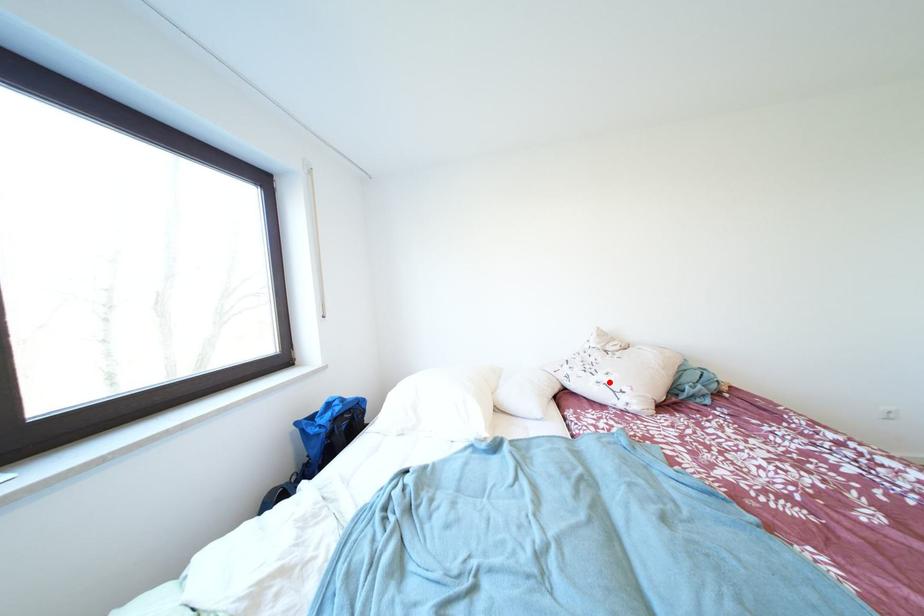
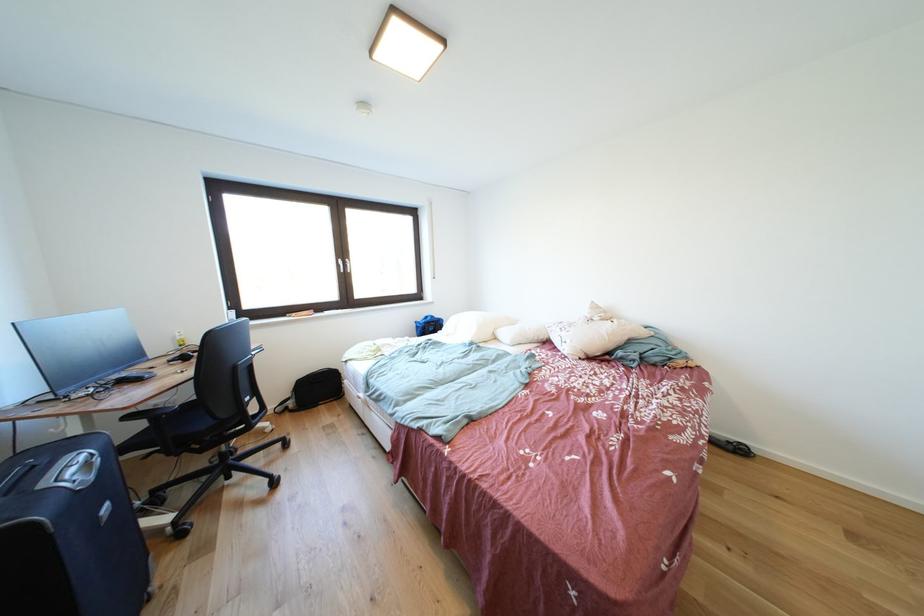
Question: I am providing you with two images of the same scene from different viewpoints. A red point is marked on the first image. At the location where the point appears in image 1, is it still visible in image 2?

Choices:
 (A) Yes
 (B) No

Answer: (A)